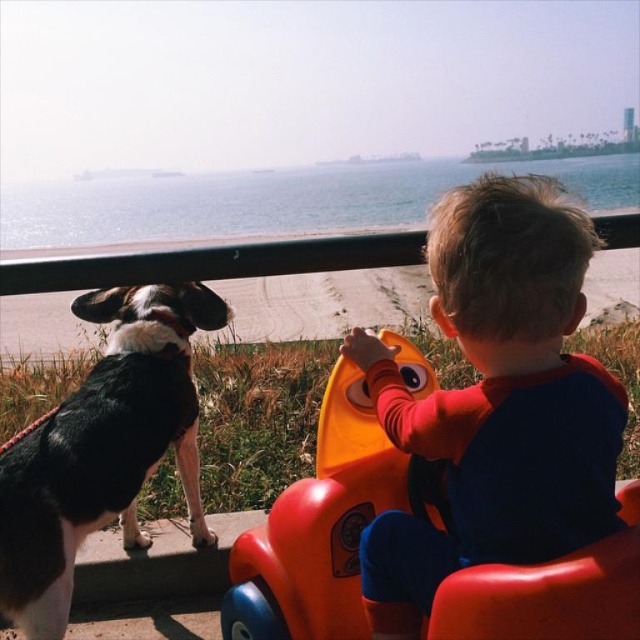
Question: Can you confirm if smooth orange plastic toy car at center is wider than orange plastic toy car at center?

Choices:
 (A) yes
 (B) no

Answer: (B)

Question: Which object appears closest to the camera in this image?

Choices:
 (A) black and white fur dog at left
 (B) orange plastic toy car at center
 (C) smooth orange plastic toy car at center

Answer: (C)

Question: Does smooth orange plastic toy car at center have a greater width compared to black and white fur dog at left?

Choices:
 (A) yes
 (B) no

Answer: (A)

Question: Does smooth orange plastic toy car at center appear under black and white fur dog at left?

Choices:
 (A) yes
 (B) no

Answer: (B)

Question: Considering the real-world distances, which object is farthest from the smooth orange plastic toy car at center?

Choices:
 (A) orange plastic toy car at center
 (B) black and white fur dog at left

Answer: (B)

Question: Which point is closer to the camera taking this photo?

Choices:
 (A) (579, 301)
 (B) (532, 600)

Answer: (B)